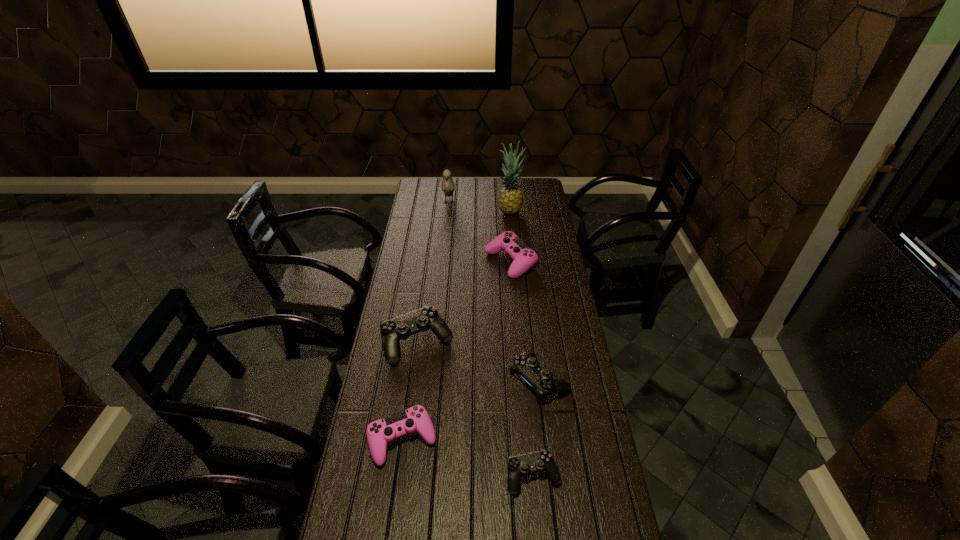
This screenshot has height=540, width=960. Identify the location of the smallest black control. (540, 461).

This screenshot has height=540, width=960. I want to click on the shortest control, so click(540, 461).

Locate an element on the screen. free location located on the front of the pineapple is located at coordinates (512, 230).

The width and height of the screenshot is (960, 540). I want to click on vacant position located at the beak of the bird, so click(444, 255).

Find the location of a particular element. The image size is (960, 540). vacant space located 0.240m on the back of the biggest black control is located at coordinates (426, 280).

Where is `vacant region located 0.130m on the left of the third farthest object`? Image resolution: width=960 pixels, height=540 pixels. vacant region located 0.130m on the left of the third farthest object is located at coordinates point(457,262).

I want to click on vacant area situated 0.240m on the back of the second biggest black control, so click(530, 310).

I want to click on vacant space located 0.260m on the right of the left pink control, so click(518, 440).

This screenshot has height=540, width=960. I want to click on free region located 0.110m on the left of the nearest black control, so click(x=469, y=476).

Identify the location of object positioned at the far edge. (448, 186).